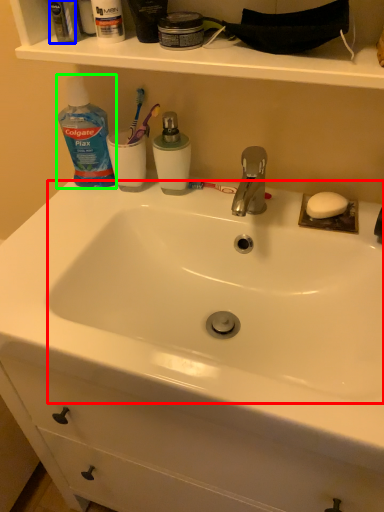
Question: Estimate the real-world distances between objects in this image. Which object is closer to sink (highlighted by a red box), mouthwash (highlighted by a blue box) or cleaning product (highlighted by a green box)?

Choices:
 (A) mouthwash
 (B) cleaning product

Answer: (B)